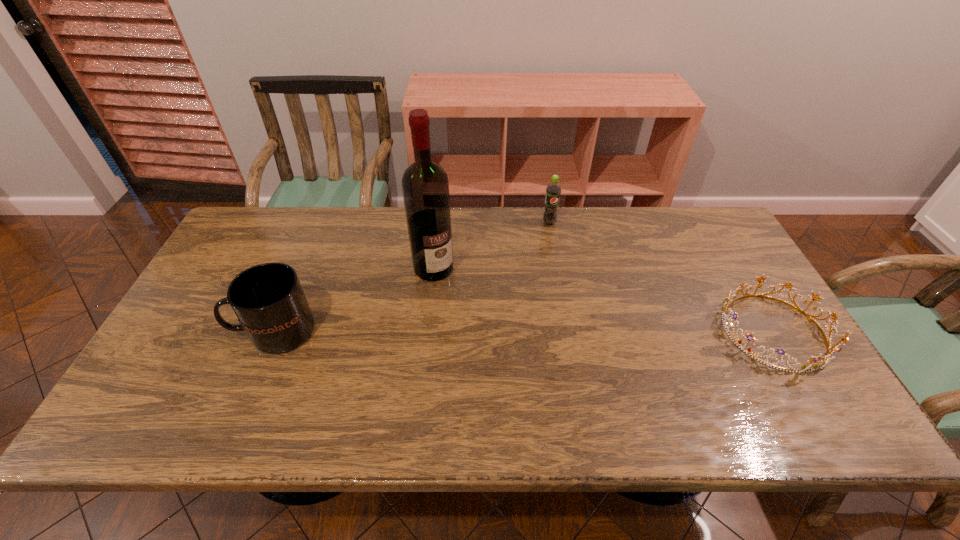
You are a GUI agent. You are given a task and a screenshot of the screen. Output one action in this format:
    pyautogui.click(x=<x>, y=<y>)
    Task: Click on the vacant space on the desktop that is between the mug and the shortest object and is positioned on the front label of the farthest object
    The width and height of the screenshot is (960, 540).
    Given the screenshot: What is the action you would take?
    pyautogui.click(x=597, y=332)

Where is `vacant space on the desktop that is between the leftmost object and the shortest object and is positioned on the front and back of the third object from right to left`? Image resolution: width=960 pixels, height=540 pixels. vacant space on the desktop that is between the leftmost object and the shortest object and is positioned on the front and back of the third object from right to left is located at coordinates (487, 331).